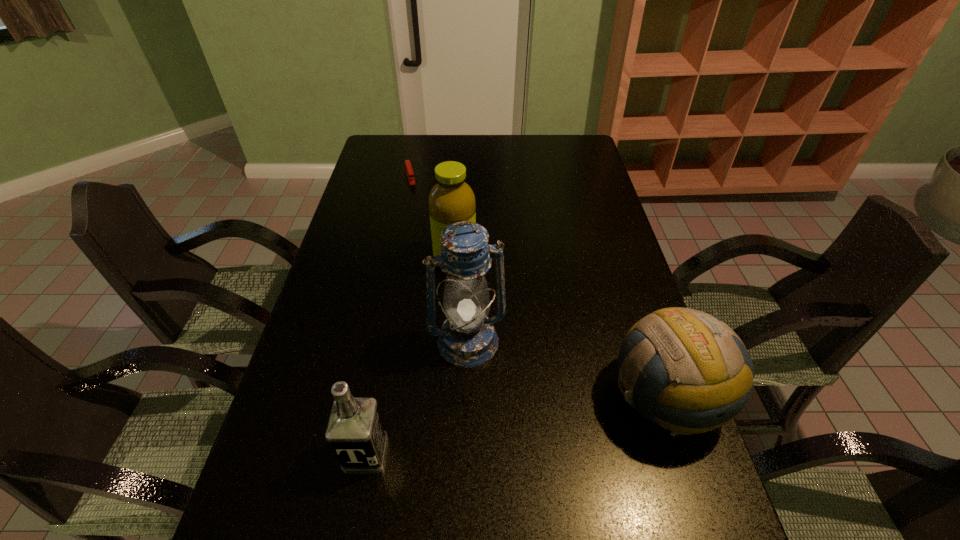
You are a GUI agent. You are given a task and a screenshot of the screen. Output one action in this format:
    pyautogui.click(x=<x>, y=<y>)
    Task: Click on the empty location between the vodka and the farthest object
    
    Given the screenshot: What is the action you would take?
    pyautogui.click(x=388, y=315)

The image size is (960, 540). Identify the location of free space between the fruit juice and the vodka. (411, 357).

The width and height of the screenshot is (960, 540). I want to click on object that ranks as the second closest to the rightmost object, so click(x=451, y=199).

Point out which object is positioned as the nearest to the vodka. Please provide its 2D coordinates. Your answer should be formatted as a tuple, i.e. [(x, y)], where the tuple contains the x and y coordinates of a point satisfying the conditions above.

[(467, 339)]

The height and width of the screenshot is (540, 960). I want to click on free region that satisfies the following two spatial constraints: 1. on the front side of the tallest object; 2. on the right side of the fourth shortest object, so click(x=450, y=342).

You are a GUI agent. You are given a task and a screenshot of the screen. Output one action in this format:
    pyautogui.click(x=<x>, y=<y>)
    Task: Click on the free space in the image that satisfies the following two spatial constraints: 1. on the front side of the volleyball; 2. on the right side of the farthest object
    This screenshot has height=540, width=960.
    Given the screenshot: What is the action you would take?
    pyautogui.click(x=365, y=396)